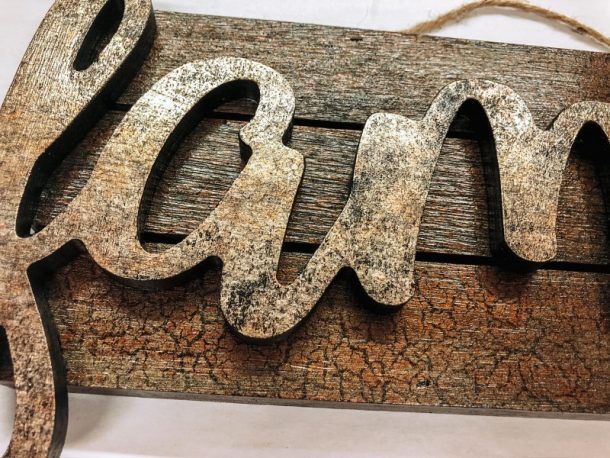
Find the location of a particular element. white surface is located at coordinates pyautogui.click(x=326, y=451).